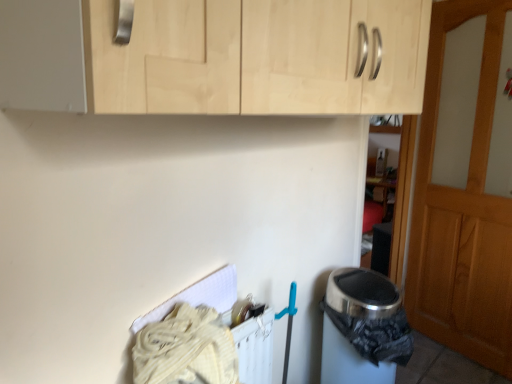
Question: Considering the positions of light wood cabinet at upper center and wooden door at right in the image, is light wood cabinet at upper center bigger or smaller than wooden door at right?

Choices:
 (A) small
 (B) big

Answer: (B)

Question: Relative to wooden door at right, is light wood cabinet at upper center in front or behind?

Choices:
 (A) behind
 (B) front

Answer: (B)

Question: Estimate the real-world distances between objects in this image. Which object is farther from the wooden door at right?

Choices:
 (A) light wood cabinet at upper center
 (B) metallic trash can at lower right

Answer: (A)

Question: Which object is the farthest from the wooden door at right?

Choices:
 (A) metallic trash can at lower right
 (B) light wood cabinet at upper center

Answer: (B)